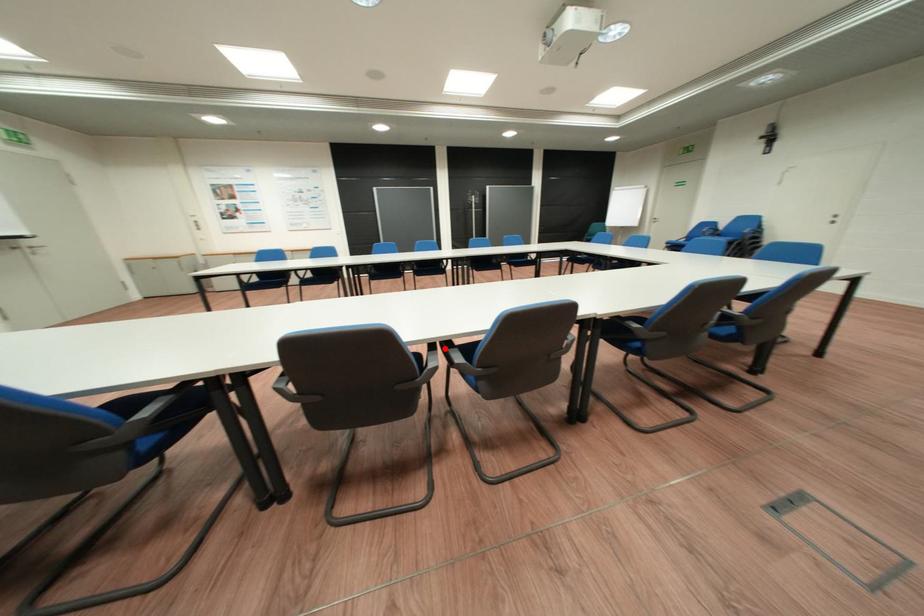
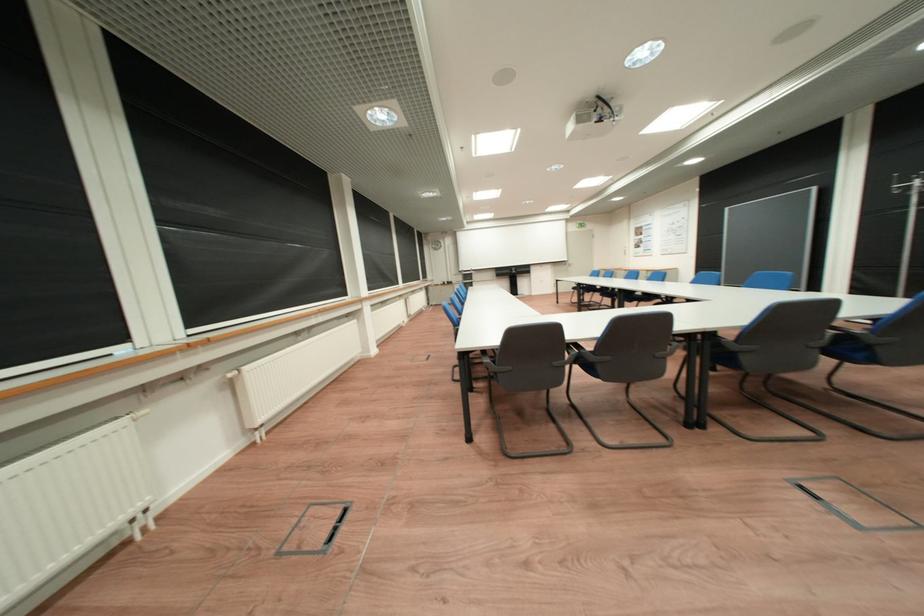
Question: I am providing you with two images of the same scene from different viewpoints. A red point is marked on the first image. Can you still see the location of the red point in image 2?

Choices:
 (A) Yes
 (B) No

Answer: (B)